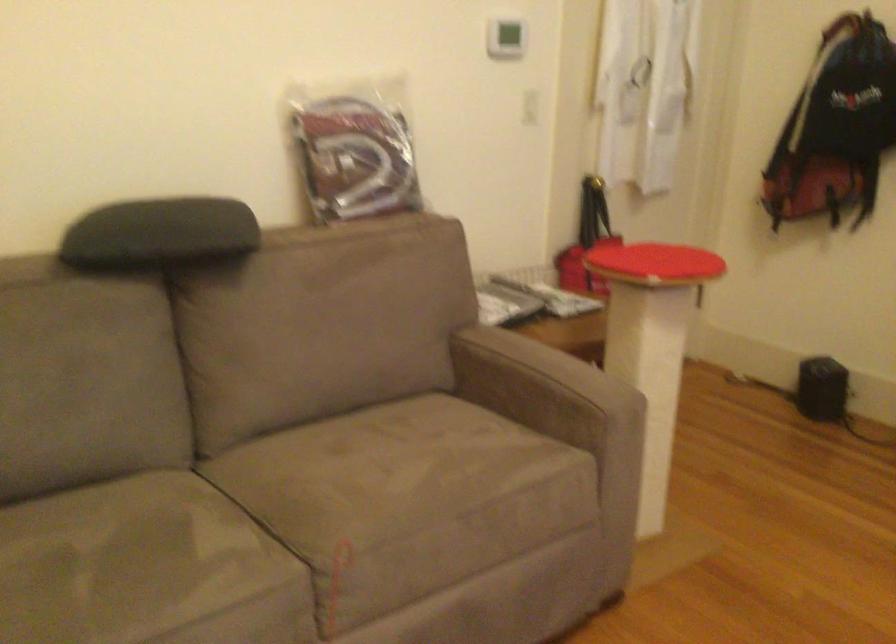
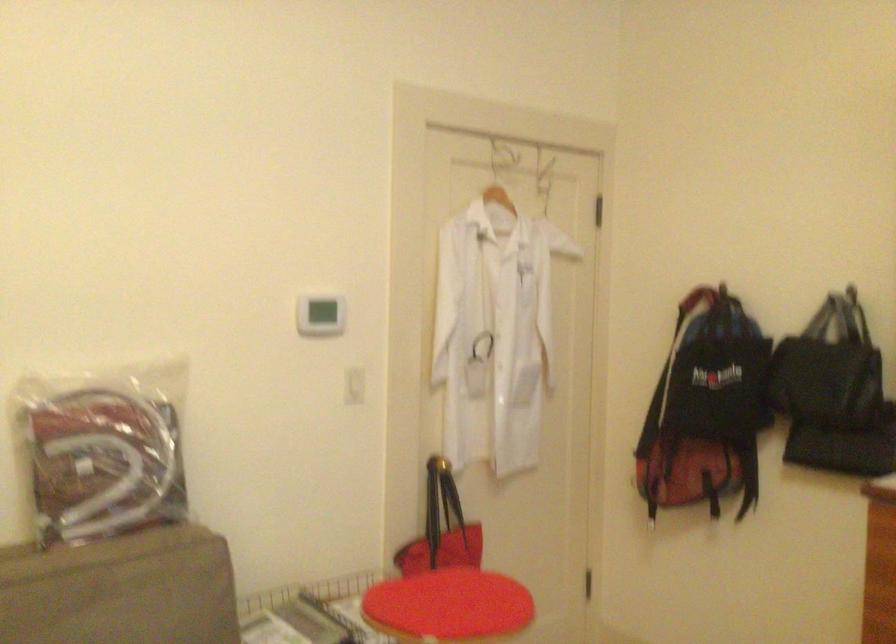
What movement of the cameraman would produce the second image?

The cameraman moved toward right, forward.